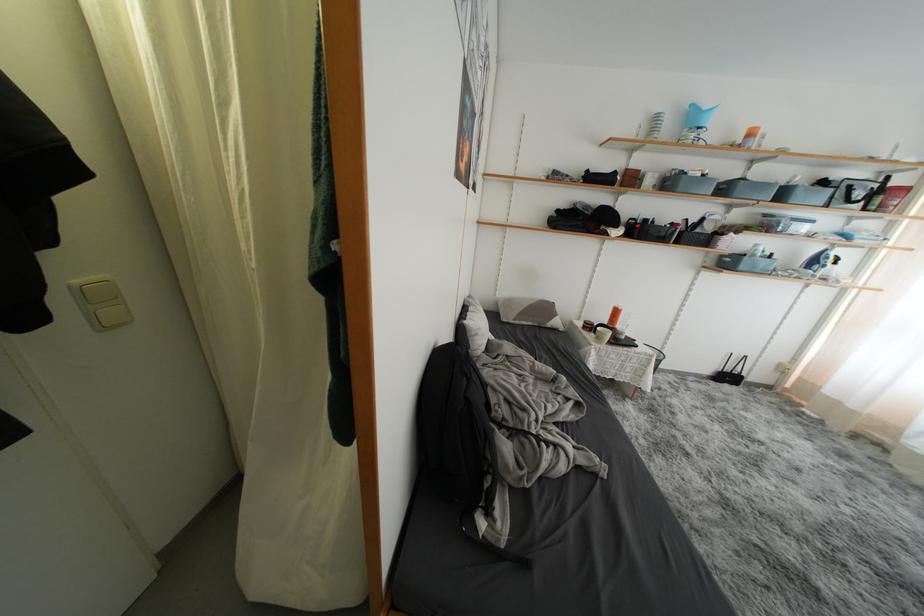
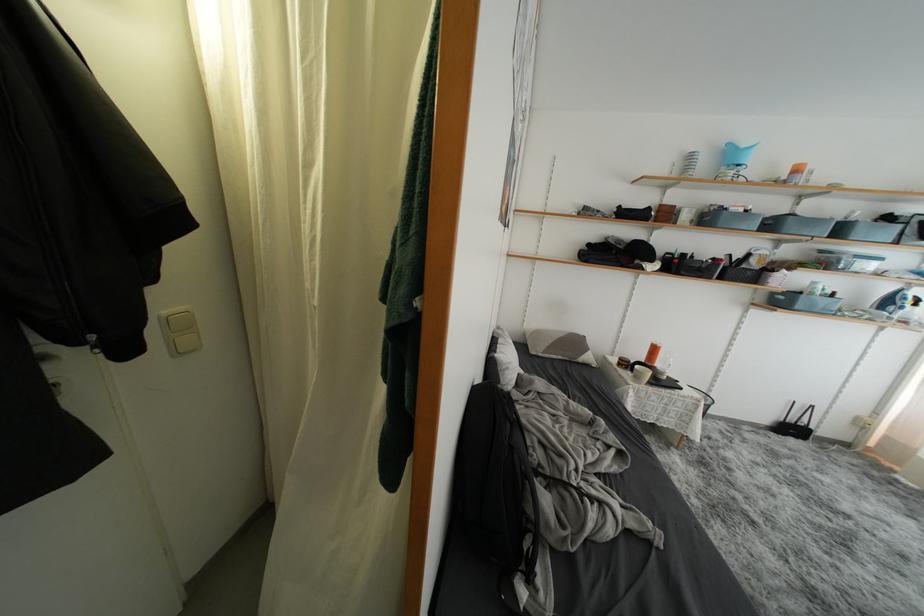
Where in the second image is the point corresponding to pixel 86 294 from the first image?

(172, 325)